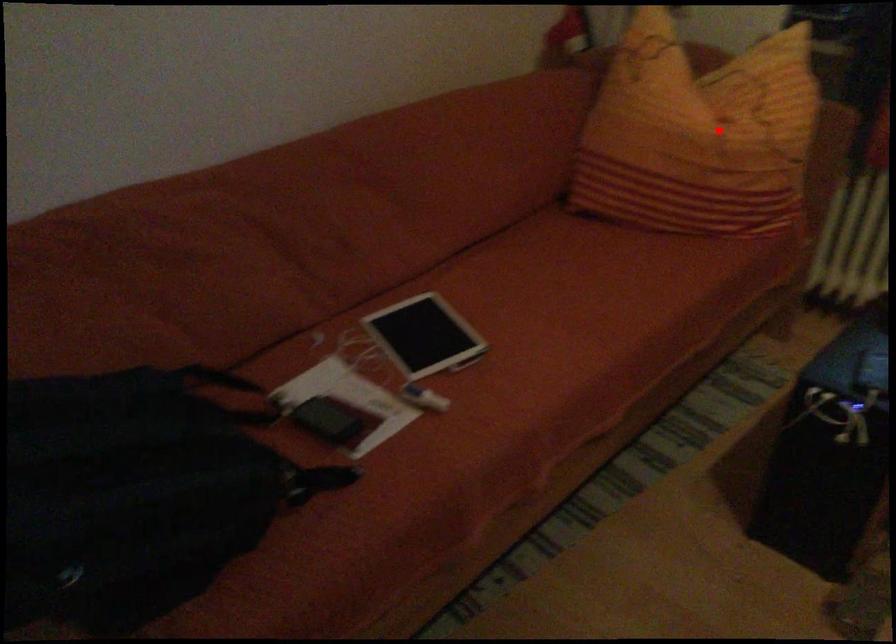
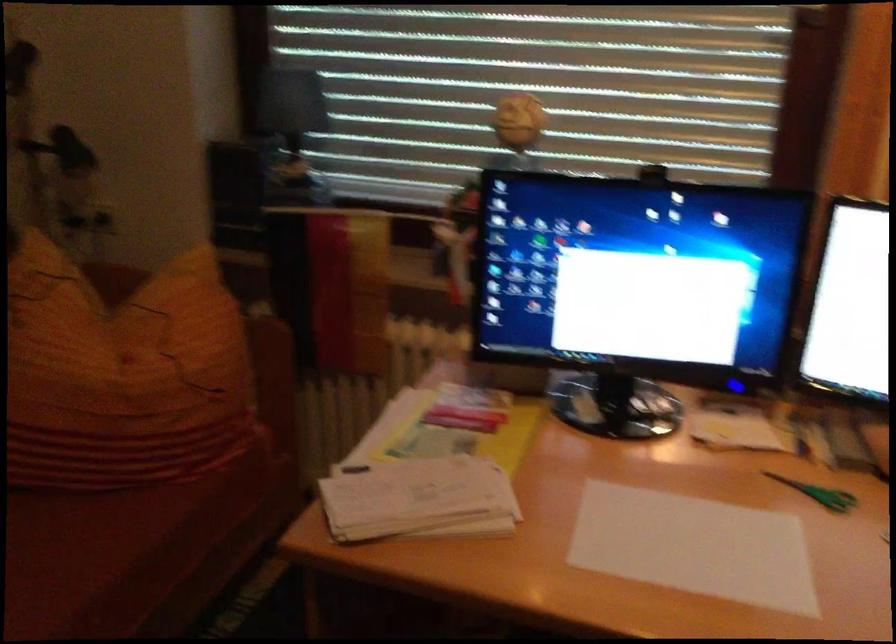
In the second image, find the point that corresponds to the highlighted location in the first image.

(122, 374)